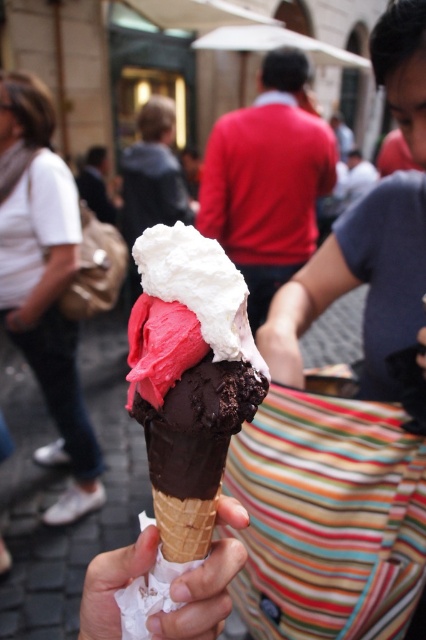
Question: Is chocolate-frosted ice cream cone at center wider than white fabric purse at lower left?

Choices:
 (A) yes
 (B) no

Answer: (B)

Question: Which point is closer to the camera?

Choices:
 (A) (187, 612)
 (B) (178, 230)
 (C) (34, 365)

Answer: (B)

Question: Is white fabric purse at lower left closer to camera compared to white paper at center?

Choices:
 (A) no
 (B) yes

Answer: (A)

Question: Which point is farther to the camera?

Choices:
 (A) (192, 609)
 (B) (166, 324)

Answer: (A)

Question: Which of the following is the closest to the observer?

Choices:
 (A) (63, 324)
 (B) (250, 368)

Answer: (B)

Question: Can you confirm if chocolate-frosted ice cream cone at center is positioned above white paper at center?

Choices:
 (A) yes
 (B) no

Answer: (A)